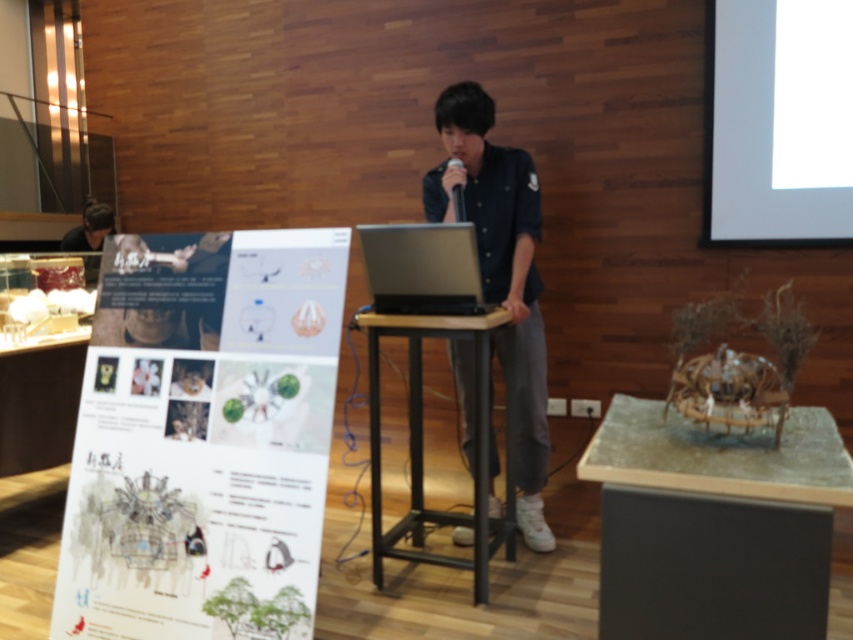
Question: Can you confirm if white paper poster at left is positioned below black matte microphone at center?

Choices:
 (A) no
 (B) yes

Answer: (B)

Question: Which of the following is the closest to the observer?

Choices:
 (A) black matte shirt at center
 (B) translucent glass table at center
 (C) black matte microphone at center
 (D) white paper poster at left

Answer: (B)

Question: Can you confirm if black metal table at center is positioned to the right of black matte microphone at center?

Choices:
 (A) no
 (B) yes

Answer: (A)

Question: Estimate the real-world distances between objects in this image. Which object is closer to the matte black laptop at left?

Choices:
 (A) black matte microphone at center
 (B) black matte shirt at center

Answer: (B)

Question: Which is nearer to the matte black laptop at left?

Choices:
 (A) black matte microphone at center
 (B) black metal table at center
 (C) white paper poster at left

Answer: (C)

Question: Observing the image, what is the correct spatial positioning of white paper poster at left in reference to matte black laptop at left?

Choices:
 (A) right
 (B) left

Answer: (A)